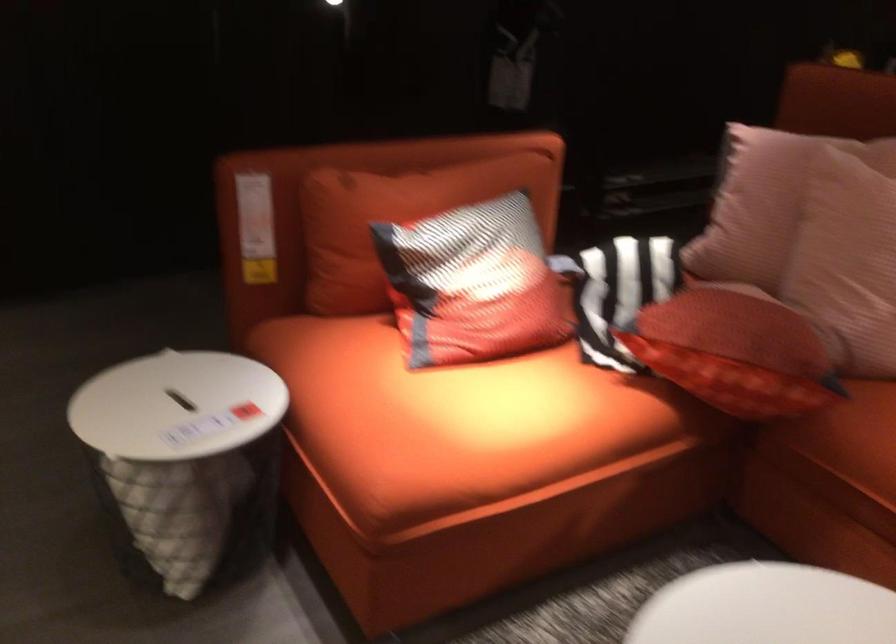
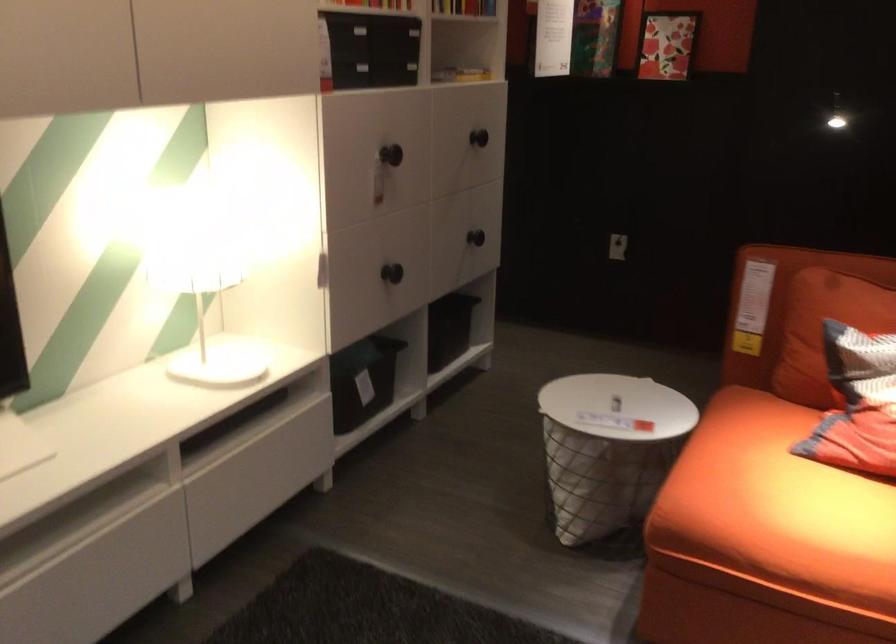
Question: The camera is either moving clockwise (left) or counter-clockwise (right) around the object. The first image is from the beginning of the video and the second image is from the end. Is the camera moving left or right when shooting the video?

Choices:
 (A) Left
 (B) Right

Answer: (B)